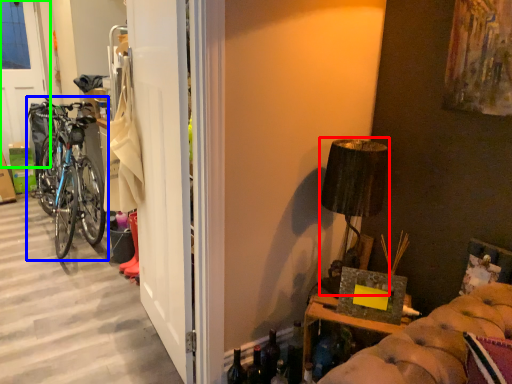
Question: Which is farther away from lamp (highlighted by a red box)? bicycle (highlighted by a blue box) or screen door (highlighted by a green box)?

Choices:
 (A) bicycle
 (B) screen door

Answer: (B)